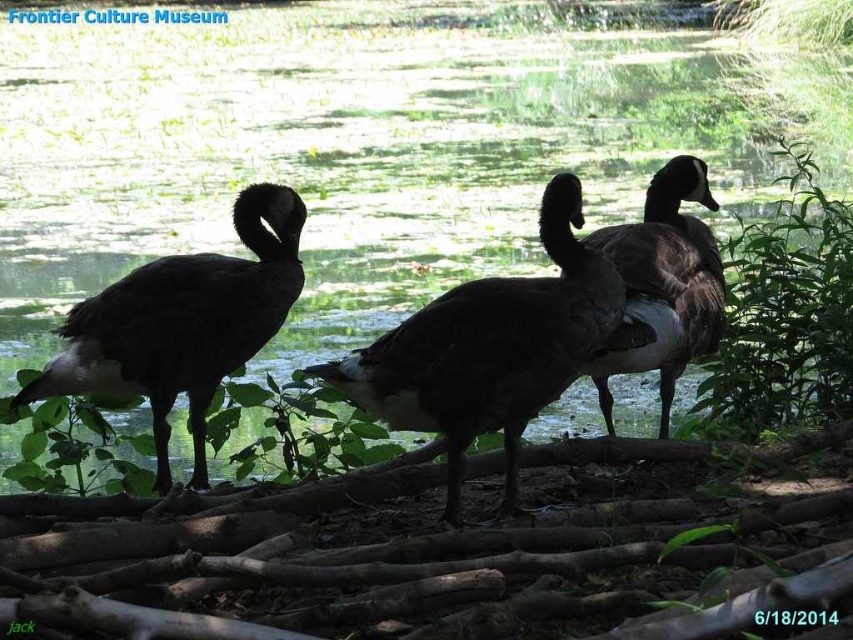
Question: Which point is farther to the camera?

Choices:
 (A) dark glossy goose at center
 (B) dark brown feathers at center
 (C) dark brown feathers at left

Answer: (C)

Question: Is dark glossy goose at center smaller than dark brown feathers at center?

Choices:
 (A) yes
 (B) no

Answer: (B)

Question: Does dark glossy goose at center have a larger size compared to dark brown feathers at left?

Choices:
 (A) no
 (B) yes

Answer: (B)

Question: Which object appears farthest from the camera in this image?

Choices:
 (A) dark brown feathers at center
 (B) dark glossy goose at center
 (C) dark brown feathers at left

Answer: (C)

Question: Estimate the real-world distances between objects in this image. Which object is closer to the dark brown feathers at center?

Choices:
 (A) dark brown feathers at left
 (B) dark glossy goose at center

Answer: (B)

Question: Is dark glossy goose at center positioned at the back of dark brown feathers at left?

Choices:
 (A) yes
 (B) no

Answer: (B)